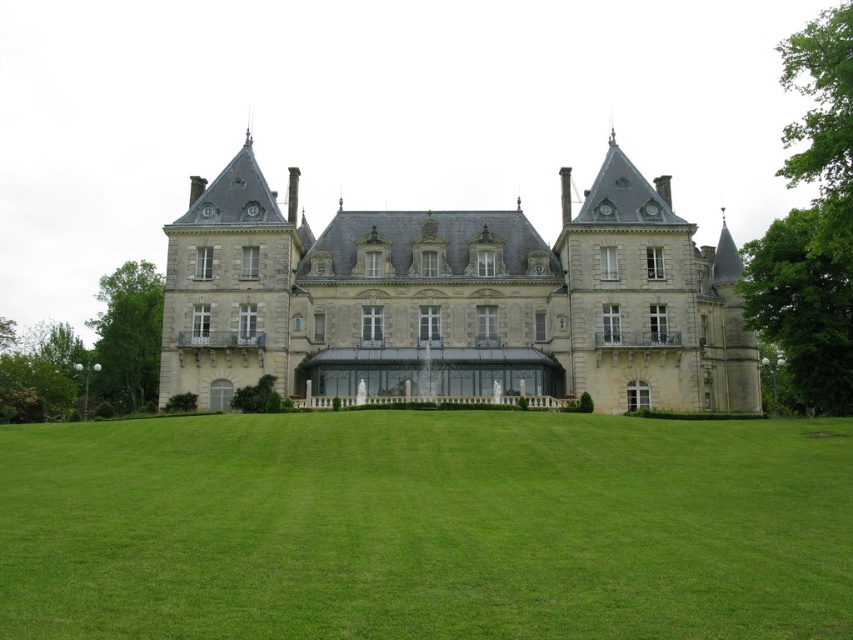
What do you see at coordinates (426, 525) in the screenshot?
I see `green grass at center` at bounding box center [426, 525].

Between green grass at center and gray stone castle at center, which one appears on the left side from the viewer's perspective?

green grass at center is more to the left.

Which is behind, point (7, 518) or point (405, 282)?

The point (405, 282) is more distant.

Identify the location of green grass at center. (426, 525).